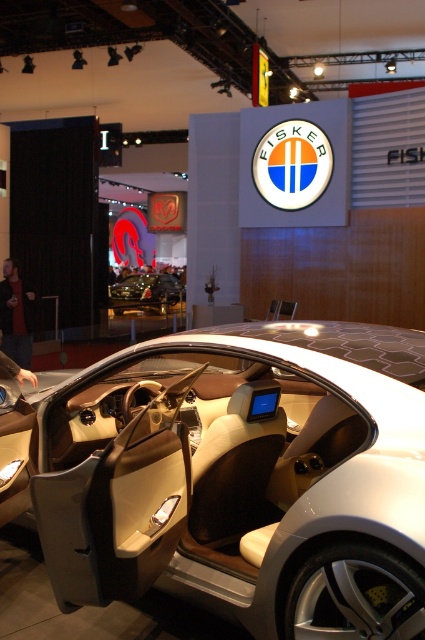
You are a photographer setting up for a car photo shoot. You need to position a dark gray jacket at lower left to highlight the shiny black car at center. Since the car is wider than the jacket, how should you arrange them to ensure the jacket doesn

The shiny black car at center is wider than the dark gray jacket at lower left. To ensure proper arrangement, place the jacket closer to the edge so it doesn

You are a car designer evaluating the layout of the car display. You notice the matte beige interior at center and the shiny black car at center. Which object is positioned lower in the image?

The matte beige interior at center is located below the shiny black car at center, so it is positioned lower in the image.

You are a designer evaluating the space inside the open car door. You need to place a black leather jacket at lower left on the matte beige interior at center. Is there enough space?

The matte beige interior at center has a larger size compared to the black leather jacket at lower left, so there is sufficient space to place the black leather jacket at lower left on the matte beige interior at center.